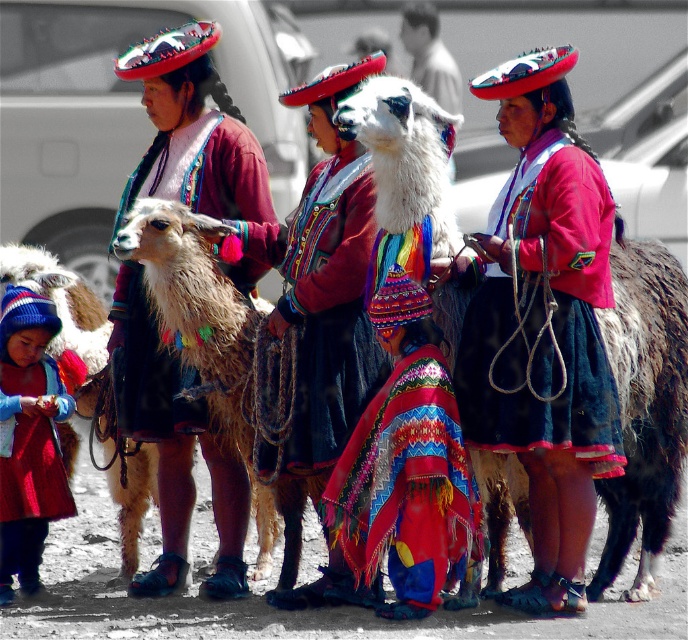
You are a traveler who wants to buy a souvenir that is bigger than the animal nearby. Which item should you choose between the multicolored woven fabric at center and the white woolen llama at left?

The multicolored woven fabric at center is larger than the white woolen llama at left, so you should choose the multicolored woven fabric at center as your souvenir.

You are a traveler who wants to take a photo of the multicolored woven poncho at center and the fuzzy wool alpaca at center. Since you want both to be clearly visible in the photo, which one should you focus on to ensure it appears larger in the image?

You should focus on the fuzzy wool alpaca at center because it is larger than the multicolored woven poncho at center, so it will appear bigger in the photo.

You are a traveler who wants to take a photo of the multicolored woven fabric at center and the white woolen llama at left. Which object should you focus on first if you want to capture both in the same frame without moving your camera?

You should focus on the white woolen llama at left first because the multicolored woven fabric at center is taller and might block the view of the llama if not positioned properly.